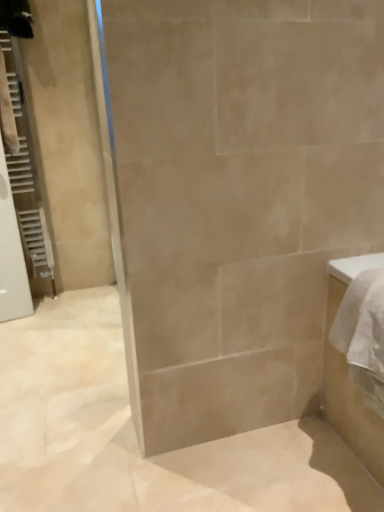
Question: Is white textured radiator at left in front of or behind white glossy cabinet at right in the image?

Choices:
 (A) front
 (B) behind

Answer: (B)

Question: In terms of height, does white textured radiator at left look taller or shorter compared to white glossy cabinet at right?

Choices:
 (A) tall
 (B) short

Answer: (A)

Question: Looking at their shapes, would you say white textured radiator at left is wider or thinner than white glossy cabinet at right?

Choices:
 (A) thin
 (B) wide

Answer: (A)

Question: Is white glossy cabinet at right to the left or to the right of white textured radiator at left in the image?

Choices:
 (A) left
 (B) right

Answer: (B)

Question: From a real-world perspective, relative to white textured radiator at left, is white glossy cabinet at right vertically above or below?

Choices:
 (A) above
 (B) below

Answer: (B)

Question: Considering the positions of point (339, 391) and point (28, 156), is point (339, 391) closer or farther from the camera than point (28, 156)?

Choices:
 (A) closer
 (B) farther

Answer: (A)

Question: Is white glossy cabinet at right in front of or behind white textured radiator at left in the image?

Choices:
 (A) front
 (B) behind

Answer: (A)